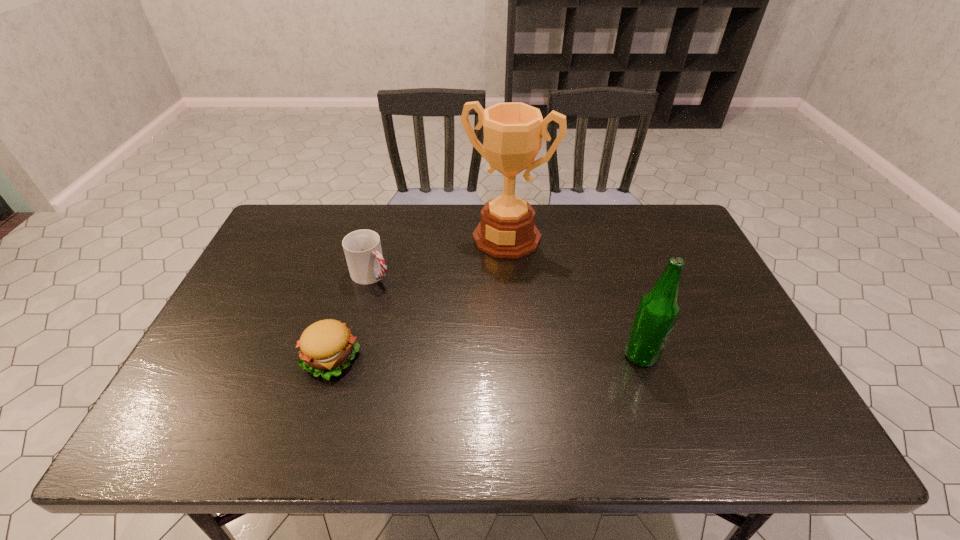
Locate an element on the screen. free space at the right edge is located at coordinates (740, 366).

What are the coordinates of `vacant space at the far left corner of the desktop` in the screenshot? It's located at (277, 230).

This screenshot has width=960, height=540. Find the location of `vacant space at the far right corner of the desktop`. vacant space at the far right corner of the desktop is located at coordinates (643, 227).

The width and height of the screenshot is (960, 540). Find the location of `free spot between the third tallest object and the farthest object`. free spot between the third tallest object and the farthest object is located at coordinates (440, 255).

This screenshot has height=540, width=960. What are the coordinates of `unoccupied position between the award and the hamburger` in the screenshot? It's located at (419, 298).

Find the location of a particular element. This screenshot has height=540, width=960. empty space between the shortest object and the third object from left to right is located at coordinates (419, 298).

At what (x,y) coordinates should I click in order to perform the action: click on free space between the third object from left to right and the shortest object. Please return your answer as a coordinate pair (x, y). The height and width of the screenshot is (540, 960). Looking at the image, I should click on (419, 298).

At what (x,y) coordinates should I click in order to perform the action: click on free space between the shortest object and the beer bottle. Please return your answer as a coordinate pair (x, y). Image resolution: width=960 pixels, height=540 pixels. Looking at the image, I should click on (486, 357).

You are a GUI agent. You are given a task and a screenshot of the screen. Output one action in this format:
    pyautogui.click(x=<x>, y=<y>)
    Task: Click on the vacant space that is in between the shortest object and the rightmost object
    The image size is (960, 540).
    Given the screenshot: What is the action you would take?
    click(x=486, y=357)

The height and width of the screenshot is (540, 960). In order to click on free space between the second farthest object and the beer bottle in this screenshot , I will do `click(506, 315)`.